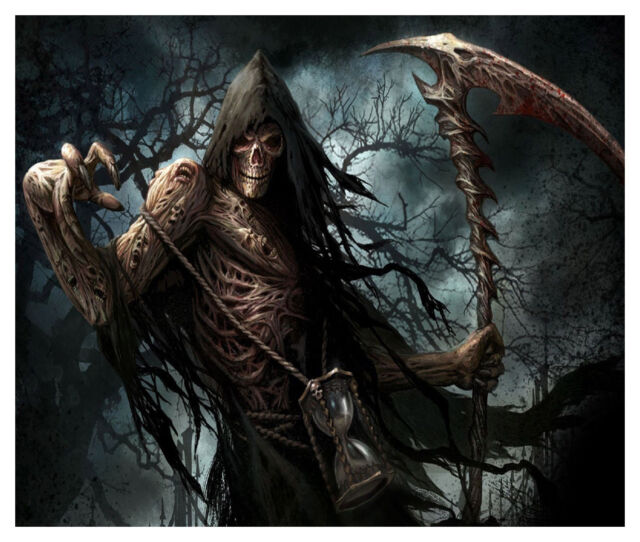
This screenshot has height=542, width=640. In order to click on timer in this screenshot , I will do [x=356, y=434].